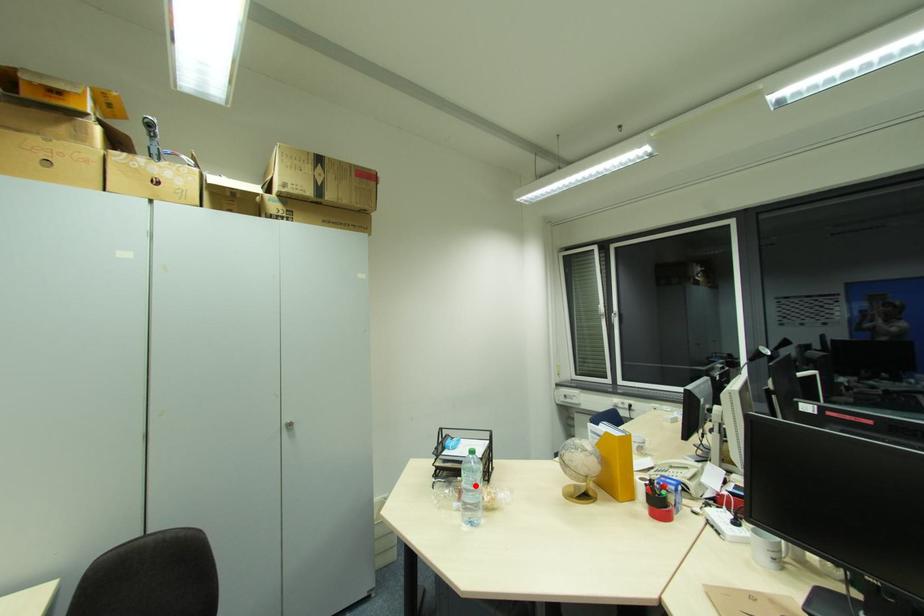
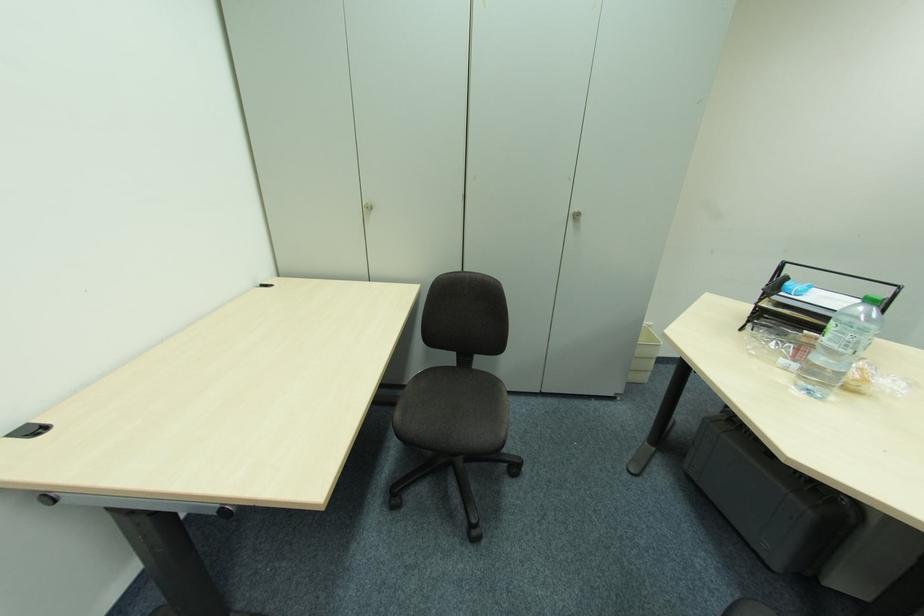
Question: I am providing you with two images of the same scene from different viewpoints. A red point is shown in image1. For the corresponding object point in image2, is it positioned nearer or farther from the camera?

Choices:
 (A) Nearer
 (B) Farther

Answer: (A)